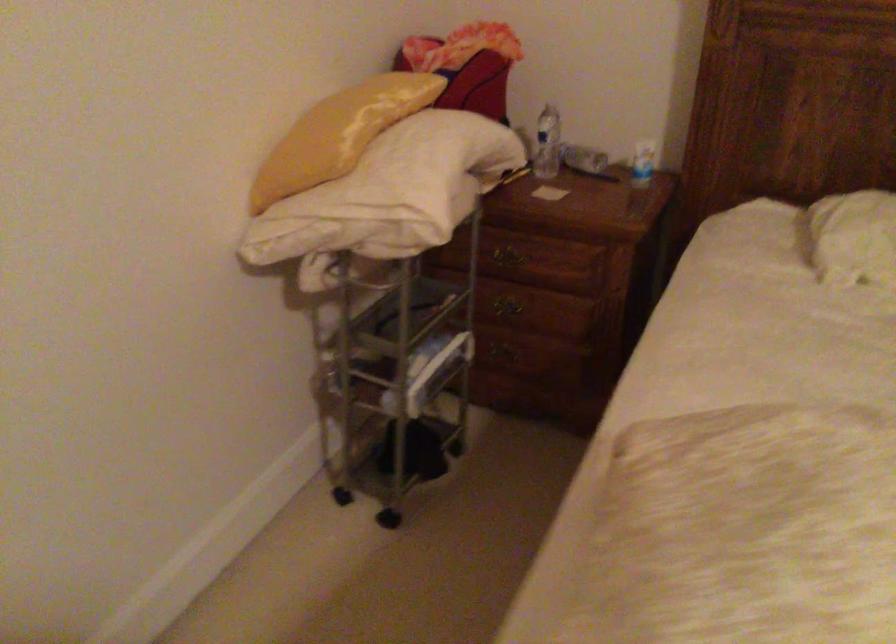
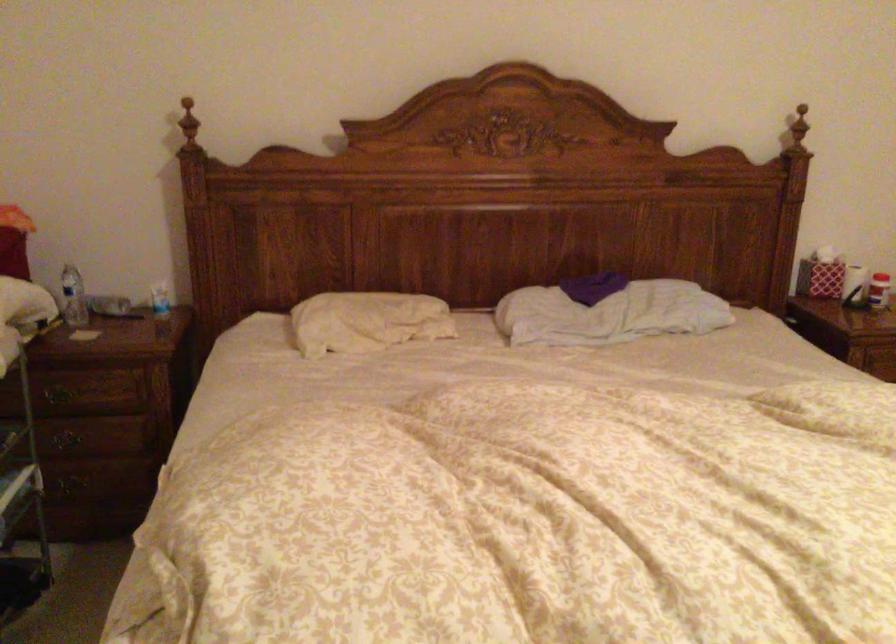
Question: How did the camera likely rotate?

Choices:
 (A) Left
 (B) Right
 (C) Up
 (D) Down

Answer: (B)